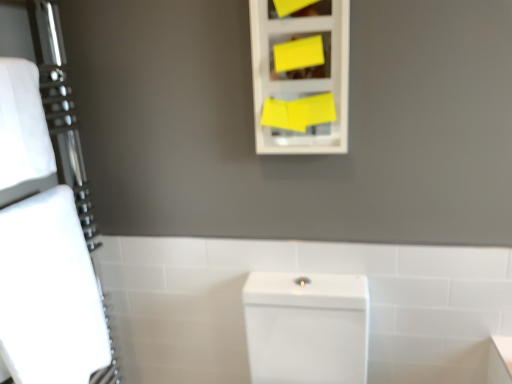
Question: From a real-world perspective, is white glossy toilet at center positioned over white glossy porcelain at center based on gravity?

Choices:
 (A) no
 (B) yes

Answer: (B)

Question: Does white glossy toilet at center have a smaller size compared to white glossy porcelain at center?

Choices:
 (A) no
 (B) yes

Answer: (B)

Question: Is white glossy toilet at center next to white glossy porcelain at center and touching it?

Choices:
 (A) yes
 (B) no

Answer: (B)

Question: Is the depth of white glossy toilet at center greater than that of white glossy porcelain at center?

Choices:
 (A) yes
 (B) no

Answer: (A)

Question: Is white glossy porcelain at center completely or partially inside white glossy toilet at center?

Choices:
 (A) yes
 (B) no

Answer: (B)

Question: Is white matte bath towel at left, the first bath towel positioned from the bottom, taller or shorter than white glossy porcelain at center?

Choices:
 (A) tall
 (B) short

Answer: (A)

Question: Is white matte bath towel at left, the first bath towel positioned from the bottom, to the left or to the right of white glossy porcelain at center in the image?

Choices:
 (A) left
 (B) right

Answer: (A)

Question: In terms of size, does white matte bath towel at left, the first bath towel positioned from the bottom, appear bigger or smaller than white glossy porcelain at center?

Choices:
 (A) big
 (B) small

Answer: (B)

Question: Considering their positions, is white matte bath towel at left, the first bath towel positioned from the bottom, located in front of or behind white glossy porcelain at center?

Choices:
 (A) front
 (B) behind

Answer: (A)

Question: From a real-world perspective, relative to white glossy porcelain at center, is yellow matte cabinet at upper center vertically above or below?

Choices:
 (A) above
 (B) below

Answer: (A)

Question: From their relative heights in the image, would you say yellow matte cabinet at upper center is taller or shorter than white glossy porcelain at center?

Choices:
 (A) short
 (B) tall

Answer: (A)

Question: Is point (303, 69) closer or farther from the camera than point (342, 379)?

Choices:
 (A) closer
 (B) farther

Answer: (A)

Question: From the image's perspective, is yellow matte cabinet at upper center positioned above or below white glossy porcelain at center?

Choices:
 (A) above
 (B) below

Answer: (A)

Question: Considering the relative positions of white matte bath towel at left, acting as the second bath towel starting from the bottom, and white glossy toilet at center in the image provided, is white matte bath towel at left, acting as the second bath towel starting from the bottom, to the left or to the right of white glossy toilet at center?

Choices:
 (A) right
 (B) left

Answer: (B)

Question: From a real-world perspective, is white matte bath towel at left, which is the first bath towel in top-to-bottom order, above or below white glossy toilet at center?

Choices:
 (A) below
 (B) above

Answer: (B)